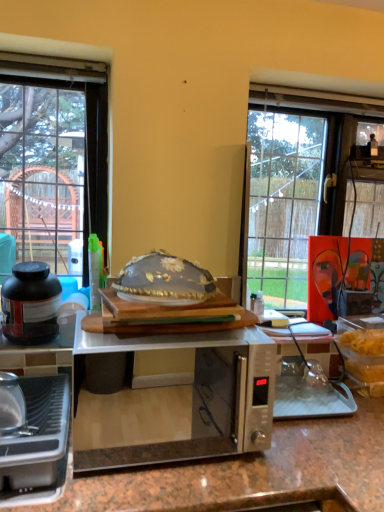
Question: Can you confirm if translucent glass bowl at center is positioned to the right of satin silver microwave at center?

Choices:
 (A) no
 (B) yes

Answer: (A)

Question: Is translucent glass bowl at center wider than satin silver microwave at center?

Choices:
 (A) no
 (B) yes

Answer: (A)

Question: From the image's perspective, is translucent glass bowl at center below satin silver microwave at center?

Choices:
 (A) yes
 (B) no

Answer: (B)

Question: Can you confirm if translucent glass bowl at center is bigger than satin silver microwave at center?

Choices:
 (A) no
 (B) yes

Answer: (A)

Question: Is translucent glass bowl at center shorter than satin silver microwave at center?

Choices:
 (A) no
 (B) yes

Answer: (B)

Question: Is translucent glass bowl at center at the left side of satin silver microwave at center?

Choices:
 (A) no
 (B) yes

Answer: (B)

Question: Is matte black jar at left, the 2th kitchen appliance viewed from the front, next to translucent glass bowl at center and touching it?

Choices:
 (A) no
 (B) yes

Answer: (A)

Question: Is matte black jar at left, the 2th kitchen appliance viewed from the front, to the right of translucent glass bowl at center from the viewer's perspective?

Choices:
 (A) no
 (B) yes

Answer: (A)

Question: Is matte black jar at left, the 2th kitchen appliance positioned from the bottom, far away from translucent glass bowl at center?

Choices:
 (A) yes
 (B) no

Answer: (B)

Question: Is matte black jar at left, placed as the 1th kitchen appliance when sorted from top to bottom, to the left of translucent glass bowl at center from the viewer's perspective?

Choices:
 (A) yes
 (B) no

Answer: (A)

Question: Could you tell me if matte black jar at left, the 2th kitchen appliance positioned from the bottom, is turned towards translucent glass bowl at center?

Choices:
 (A) no
 (B) yes

Answer: (A)

Question: From the image's perspective, would you say matte black jar at left, the 2th kitchen appliance viewed from the front, is shown under translucent glass bowl at center?

Choices:
 (A) no
 (B) yes

Answer: (B)

Question: Does translucent glass bowl at center appear on the right side of metallic silver toaster at lower left, the first kitchen appliance when ordered from front to back?

Choices:
 (A) yes
 (B) no

Answer: (A)